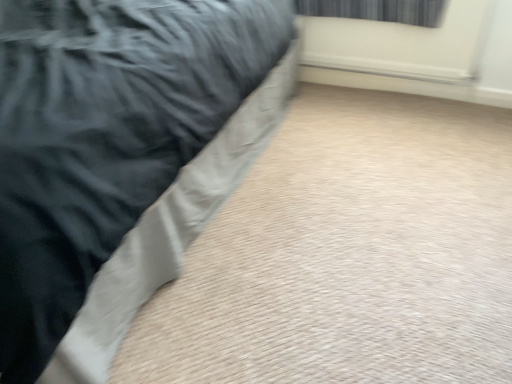
Question: From a real-world perspective, relative to dark gray fabric curtain at upper right, is satin black bed at left vertically above or below?

Choices:
 (A) above
 (B) below

Answer: (B)

Question: Is satin black bed at left inside or outside of dark gray fabric curtain at upper right?

Choices:
 (A) outside
 (B) inside

Answer: (A)

Question: Visually, is satin black bed at left positioned to the left or to the right of dark gray fabric curtain at upper right?

Choices:
 (A) right
 (B) left

Answer: (B)

Question: Is point (410, 0) closer or farther from the camera than point (81, 190)?

Choices:
 (A) farther
 (B) closer

Answer: (A)

Question: Is dark gray fabric curtain at upper right inside the boundaries of satin black bed at left, or outside?

Choices:
 (A) inside
 (B) outside

Answer: (B)

Question: Considering the positions of dark gray fabric curtain at upper right and satin black bed at left in the image, is dark gray fabric curtain at upper right bigger or smaller than satin black bed at left?

Choices:
 (A) small
 (B) big

Answer: (A)

Question: From the image's perspective, is dark gray fabric curtain at upper right positioned above or below satin black bed at left?

Choices:
 (A) below
 (B) above

Answer: (B)